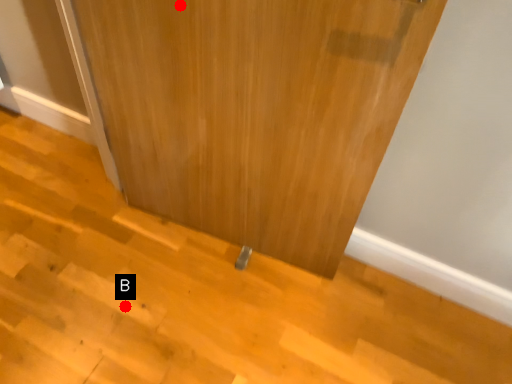
Question: Two points are circled on the image, labeled by A and B beside each circle. Which of the following is the farthest from the observer?

Choices:
 (A) A is further
 (B) B is further

Answer: (B)